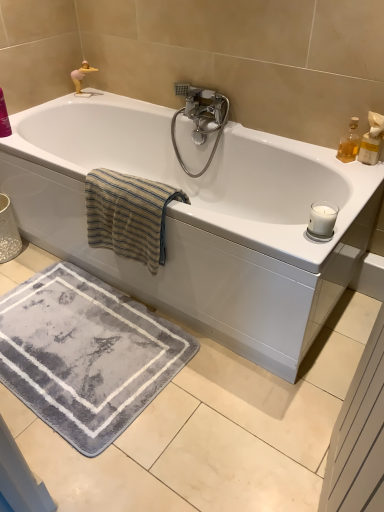
This screenshot has height=512, width=384. What do you see at coordinates (370, 148) in the screenshot?
I see `translucent glass bottle at upper right` at bounding box center [370, 148].

What do you see at coordinates (349, 143) in the screenshot? Image resolution: width=384 pixels, height=512 pixels. I see `translucent amber glass at upper right` at bounding box center [349, 143].

The width and height of the screenshot is (384, 512). Find the location of `translucent amber glass at upper right`. translucent amber glass at upper right is located at coordinates click(349, 143).

This screenshot has height=512, width=384. What are the coordinates of `beige striped towel at upper left` in the screenshot? It's located at (129, 215).

Is beige striped towel at upper left behind polished chrome faucet at upper center?

No, the depth of beige striped towel at upper left is less than that of polished chrome faucet at upper center.

Is beige striped towel at upper left facing away from polished chrome faucet at upper center?

Yes, polished chrome faucet at upper center is at the back of beige striped towel at upper left.

Does beige striped towel at upper left have a greater height compared to polished chrome faucet at upper center?

In fact, beige striped towel at upper left may be shorter than polished chrome faucet at upper center.

Is point (144, 222) closer or farther from the camera than point (202, 132)?

Point (144, 222).

Considering the positions of points (223, 124) and (361, 141), is point (223, 124) farther from camera compared to point (361, 141)?

Yes, it is behind point (361, 141).

Would you say polished chrome faucet at upper center is to the left or to the right of translucent glass bottle at upper right in the picture?

From the image, it's evident that polished chrome faucet at upper center is to the left of translucent glass bottle at upper right.

Is the position of polished chrome faucet at upper center more distant than that of translucent glass bottle at upper right?

Yes, it is.

Based on the photo, between polished chrome faucet at upper center and translucent glass bottle at upper right, which one has larger width?

polished chrome faucet at upper center.

Based on the photo, which of these two, white glossy bathtub at center or beige striped towel at upper left, stands shorter?

beige striped towel at upper left is shorter.

Considering the points (245, 280) and (94, 234), which point is in front, point (245, 280) or point (94, 234)?

The point (245, 280) is in front.

Is white glossy bathtub at center far from beige striped towel at upper left?

No, there isn't a large distance between white glossy bathtub at center and beige striped towel at upper left.

From a real-world perspective, is white glossy bathtub at center located higher than beige striped towel at upper left?

No, from a real-world perspective, white glossy bathtub at center is not above beige striped towel at upper left.

Are translucent glass bottle at upper right and translucent amber glass at upper right making contact?

Yes, translucent glass bottle at upper right is next to translucent amber glass at upper right.

Consider the image. Is translucent glass bottle at upper right aimed at translucent amber glass at upper right?

No.

Identify the location of toiletry on the right of translucent amber glass at upper right. This screenshot has height=512, width=384. (370, 148).

Between translucent glass bottle at upper right and translucent amber glass at upper right, which one is positioned in front?

translucent glass bottle at upper right is closer to the camera.

Consider the image. From a real-world perspective, is beige striped towel at upper left positioned under white glossy bathtub at center based on gravity?

No, from a real-world perspective, beige striped towel at upper left is not beneath white glossy bathtub at center.

Which of these two, beige striped towel at upper left or white glossy bathtub at center, is bigger?

Bigger between the two is white glossy bathtub at center.

Considering the sizes of objects beige striped towel at upper left and white glossy bathtub at center in the image provided, who is shorter, beige striped towel at upper left or white glossy bathtub at center?

beige striped towel at upper left.

Does translucent glass bottle at upper right come in front of white glossy bathtub at center?

No, translucent glass bottle at upper right is further to the viewer.

From the image's perspective, is translucent glass bottle at upper right beneath white glossy bathtub at center?

No, from the image's perspective, translucent glass bottle at upper right is not below white glossy bathtub at center.

Is translucent glass bottle at upper right outside of white glossy bathtub at center?

Indeed, translucent glass bottle at upper right is completely outside white glossy bathtub at center.

Can translucent amber glass at upper right be found inside white glossy bathtub at center?

No, translucent amber glass at upper right is not inside white glossy bathtub at center.

Considering the relative sizes of white glossy bathtub at center and translucent amber glass at upper right in the image provided, is white glossy bathtub at center taller than translucent amber glass at upper right?

Yes, white glossy bathtub at center is taller than translucent amber glass at upper right.

Considering the sizes of objects white glossy bathtub at center and translucent amber glass at upper right in the image provided, who is bigger, white glossy bathtub at center or translucent amber glass at upper right?

Bigger between the two is white glossy bathtub at center.

Is white glossy bathtub at center not close to translucent amber glass at upper right?

Actually, white glossy bathtub at center and translucent amber glass at upper right are a little close together.

What are the coordinates of `bath towel on the left of polished chrome faucet at upper center` in the screenshot? It's located at (129, 215).

The width and height of the screenshot is (384, 512). I want to click on tap behind the translucent glass bottle at upper right, so (x=201, y=118).

Looking at the image, which one is located closer to polished chrome faucet at upper center, translucent glass bottle at upper right or translucent amber glass at upper right?

translucent amber glass at upper right lies closer to polished chrome faucet at upper center than the other object.

Considering their positions, is white glossy bathtub at center positioned further to polished chrome faucet at upper center than translucent amber glass at upper right?

Based on the image, translucent amber glass at upper right appears to be further to polished chrome faucet at upper center.

Estimate the real-world distances between objects in this image. Which object is further from translucent glass bottle at upper right, polished chrome faucet at upper center or translucent amber glass at upper right?

polished chrome faucet at upper center lies further to translucent glass bottle at upper right than the other object.

Estimate the real-world distances between objects in this image. Which object is closer to beige striped towel at upper left, translucent glass bottle at upper right or white glossy bathtub at center?

The object closer to beige striped towel at upper left is white glossy bathtub at center.

Based on their spatial positions, is translucent amber glass at upper right or beige striped towel at upper left further from polished chrome faucet at upper center?

beige striped towel at upper left is positioned further to the anchor polished chrome faucet at upper center.

Based on their spatial positions, is beige striped towel at upper left or translucent amber glass at upper right closer to white glossy bathtub at center?

beige striped towel at upper left is closer to white glossy bathtub at center.

Based on their spatial positions, is beige striped towel at upper left or translucent amber glass at upper right further from translucent glass bottle at upper right?

The object further to translucent glass bottle at upper right is beige striped towel at upper left.

Looking at the image, which one is located closer to beige striped towel at upper left, polished chrome faucet at upper center or white glossy bathtub at center?

white glossy bathtub at center is closer to beige striped towel at upper left.

The image size is (384, 512). I want to click on soap dispenser situated between white glossy bathtub at center and translucent glass bottle at upper right from left to right, so click(x=349, y=143).

What are the coordinates of `bathtub between beige striped towel at upper left and translucent amber glass at upper right` in the screenshot? It's located at (200, 219).

This screenshot has width=384, height=512. What are the coordinates of `tap between white glossy bathtub at center and translucent amber glass at upper right from left to right` in the screenshot? It's located at (201, 118).

The height and width of the screenshot is (512, 384). In order to click on bath towel between white glossy bathtub at center and polished chrome faucet at upper center from front to back in this screenshot , I will do `click(129, 215)`.